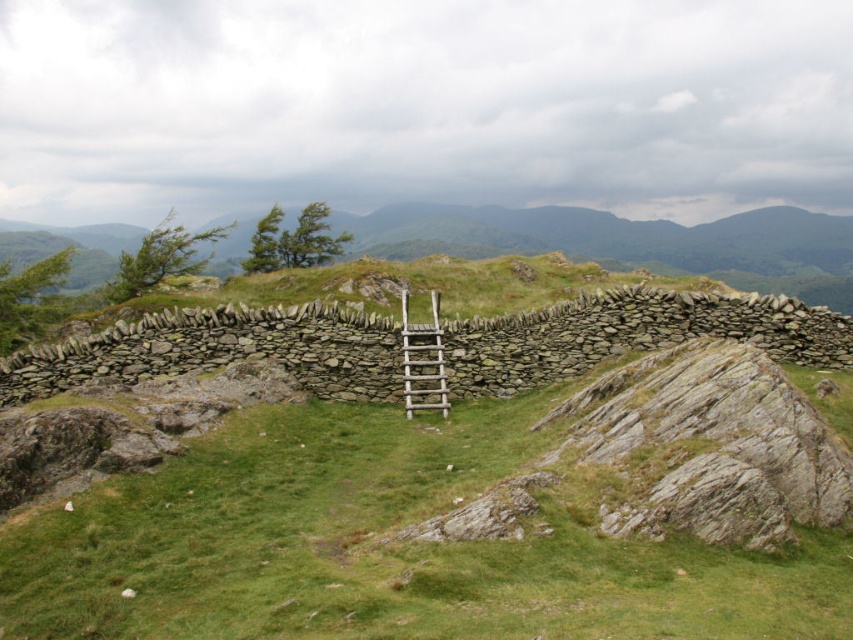
Is the position of green grassy at center less distant than that of wooden ladder at center?

Yes, it is in front of wooden ladder at center.

Describe the element at coordinates (445, 529) in the screenshot. This screenshot has height=640, width=853. I see `green grassy at center` at that location.

Where is `green grassy at center`? The height and width of the screenshot is (640, 853). green grassy at center is located at coordinates (445, 529).